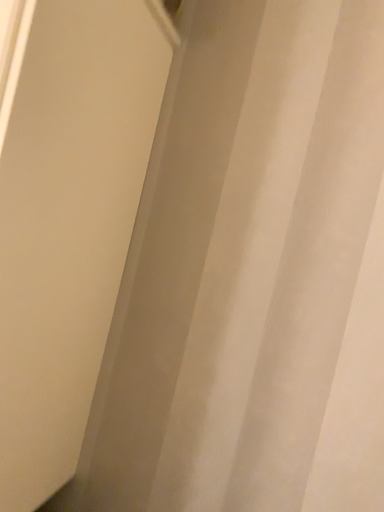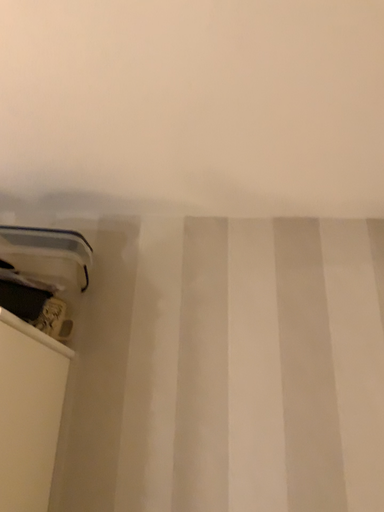
Question: Which way did the camera rotate in the video?

Choices:
 (A) rotated right
 (B) rotated left

Answer: (A)